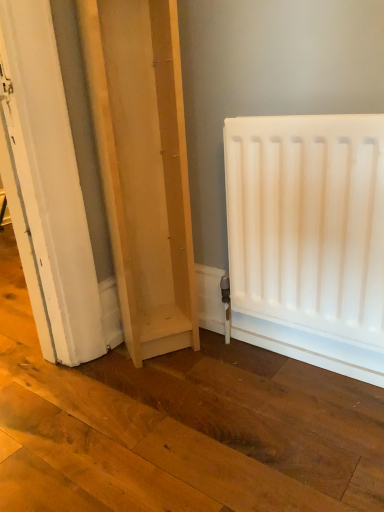
Describe the element at coordinates (143, 167) in the screenshot. I see `light wood door at left` at that location.

The height and width of the screenshot is (512, 384). Identify the location of light wood door at left. (143, 167).

What are the coordinates of `light wood door at left` in the screenshot? It's located at (143, 167).